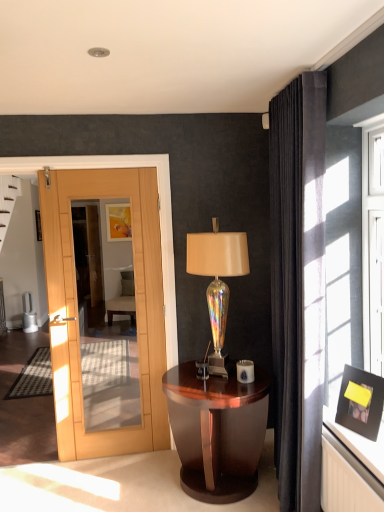
Question: Does matte black picture frame at upper right, which is the 2th picture frame from back to front, appear on the right side of glossy wood nightstand at center?

Choices:
 (A) yes
 (B) no

Answer: (A)

Question: Is matte black picture frame at upper right, which is the 2th picture frame from back to front, outside of glossy wood nightstand at center?

Choices:
 (A) yes
 (B) no

Answer: (A)

Question: From a real-world perspective, is matte black picture frame at upper right, which appears as the first picture frame when ordered from the bottom, below glossy wood nightstand at center?

Choices:
 (A) no
 (B) yes

Answer: (A)

Question: Is matte black picture frame at upper right, the second picture frame from the top, behind glossy wood nightstand at center?

Choices:
 (A) yes
 (B) no

Answer: (B)

Question: Does matte black picture frame at upper right, the second picture frame when ordered from left to right, have a larger size compared to glossy wood nightstand at center?

Choices:
 (A) no
 (B) yes

Answer: (A)

Question: Does matte black picture frame at upper right, the second picture frame from the top, have a greater width compared to glossy wood nightstand at center?

Choices:
 (A) no
 (B) yes

Answer: (A)

Question: From a real-world perspective, does glossy wood nightstand at center sit lower than matte black picture frame at upper right, which appears as the 1th picture frame when viewed from the front?

Choices:
 (A) yes
 (B) no

Answer: (A)

Question: Considering the relative positions of glossy wood nightstand at center and matte black picture frame at upper right, which appears as the first picture frame when ordered from the bottom, in the image provided, is glossy wood nightstand at center in front of matte black picture frame at upper right, which appears as the first picture frame when ordered from the bottom,?

Choices:
 (A) yes
 (B) no

Answer: (B)

Question: Is glossy wood nightstand at center far away from matte black picture frame at upper right, which appears as the first picture frame when ordered from the bottom?

Choices:
 (A) no
 (B) yes

Answer: (A)

Question: Is glossy wood nightstand at center in contact with matte black picture frame at upper right, which is the 2th picture frame from back to front?

Choices:
 (A) yes
 (B) no

Answer: (B)

Question: From a real-world perspective, is glossy wood nightstand at center on top of matte black picture frame at upper right, which appears as the 1th picture frame when viewed from the front?

Choices:
 (A) yes
 (B) no

Answer: (B)

Question: Is glossy wood nightstand at center to the left of matte black picture frame at upper right, the second picture frame from the top, from the viewer's perspective?

Choices:
 (A) no
 (B) yes

Answer: (B)

Question: From a real-world perspective, is iridescent glass table lamp at center beneath glossy wood nightstand at center?

Choices:
 (A) no
 (B) yes

Answer: (A)